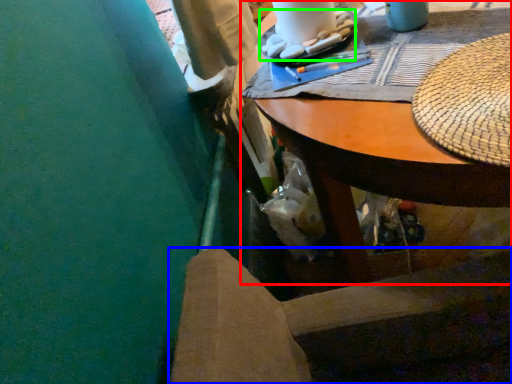
Question: Estimate the real-world distances between objects in this image. Which object is closer to desk (highlighted by a red box), chair (highlighted by a blue box) or food (highlighted by a green box)?

Choices:
 (A) chair
 (B) food

Answer: (B)